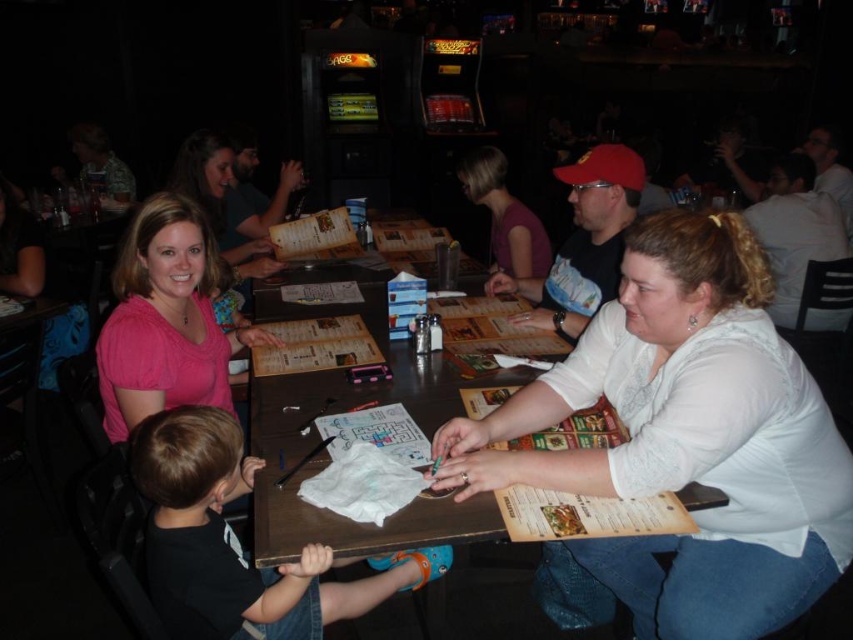
You are a photographer trying to capture a closeup shot of the object at point [711,227] and the object at point [567,262]. Since you can only focus on one object at a time, which point should you focus on to get the closest subject in the frame?

You should focus on point [711,227] because it is closer to the camera than point [567,262].

You are a delivery person standing at the entrance of the dining area. You need to deliver a package to the table where the pink matte shirt at upper left and white matte shirt at upper right are seated. The delivery robot you are using has a maximum delivery range of 8 feet. Can the robot successfully deliver the package to the table where both shirts are located?

The distance between the pink matte shirt at upper left and white matte shirt at upper right is 8.45 feet. Since the robot has a maximum range of 8 feet, it cannot reach the table where both shirts are located.

You are a photographer taking a group photo of the people at the table. You notice the pink matte shirt at upper left and the white matte shirt at upper right. Which shirt should you adjust to ensure both shirts are of similar width in the photo?

You should adjust the pink matte shirt at upper left because it has a lesser width compared to the white matte shirt at upper right, so widening it would make them similar.